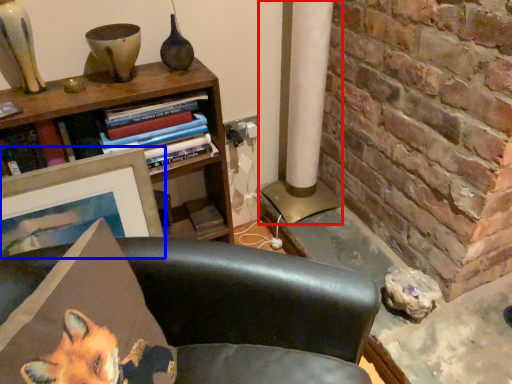
Question: Which object is further to the camera taking this photo, pillar (highlighted by a red box) or picture frame (highlighted by a blue box)?

Choices:
 (A) pillar
 (B) picture frame

Answer: (A)